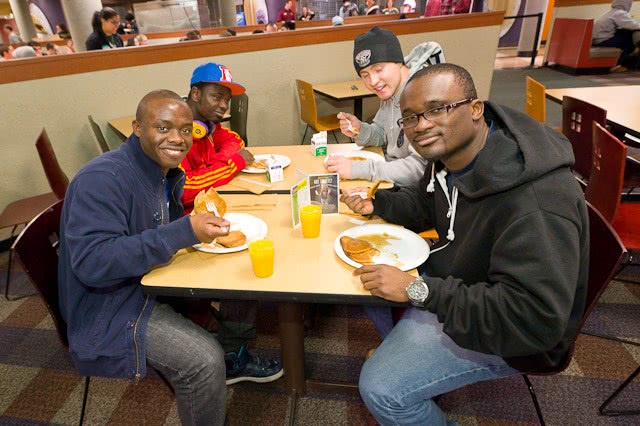
At what (x,y) coordinates should I click in order to perform the action: click on yellow cup on tabletop. Please return your answer as a coordinate pair (x, y). Looking at the image, I should click on (260, 265), (312, 222).